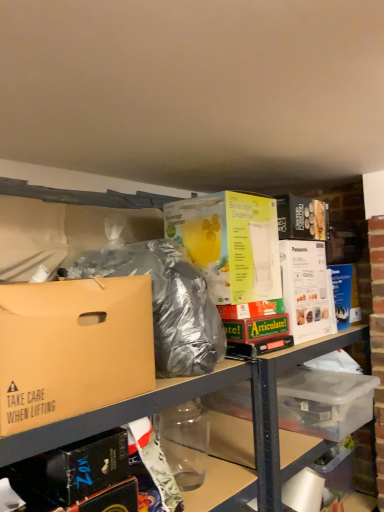
Question: From the image's perspective, is clear plastic bottle at lower center beneath clear plastic storage box at lower right?

Choices:
 (A) yes
 (B) no

Answer: (B)

Question: Is clear plastic bottle at lower center positioned far away from clear plastic storage box at lower right?

Choices:
 (A) no
 (B) yes

Answer: (A)

Question: From the image's perspective, is clear plastic bottle at lower center on top of clear plastic storage box at lower right?

Choices:
 (A) yes
 (B) no

Answer: (A)

Question: Does clear plastic bottle at lower center have a larger size compared to clear plastic storage box at lower right?

Choices:
 (A) yes
 (B) no

Answer: (B)

Question: Is clear plastic bottle at lower center at the right side of clear plastic storage box at lower right?

Choices:
 (A) yes
 (B) no

Answer: (B)

Question: Would you say clear plastic bottle at lower center is to the left or to the right of shiny metallic bag at center in the picture?

Choices:
 (A) right
 (B) left

Answer: (B)

Question: In terms of size, does clear plastic bottle at lower center appear bigger or smaller than shiny metallic bag at center?

Choices:
 (A) big
 (B) small

Answer: (B)

Question: From the image's perspective, is clear plastic bottle at lower center located above or below shiny metallic bag at center?

Choices:
 (A) below
 (B) above

Answer: (A)

Question: Is clear plastic bottle at lower center wider or thinner than shiny metallic bag at center?

Choices:
 (A) wide
 (B) thin

Answer: (A)

Question: Is yellow cardboard beverage dispenser at center, the 1th box when ordered from back to front, spatially inside shiny metallic bag at center, or outside of it?

Choices:
 (A) inside
 (B) outside

Answer: (B)

Question: Considering the positions of yellow cardboard beverage dispenser at center, the 2th box positioned from the left, and shiny metallic bag at center in the image, is yellow cardboard beverage dispenser at center, the 2th box positioned from the left, wider or thinner than shiny metallic bag at center?

Choices:
 (A) thin
 (B) wide

Answer: (B)

Question: Looking at the image, does yellow cardboard beverage dispenser at center, which is the first box from right to left, seem bigger or smaller compared to shiny metallic bag at center?

Choices:
 (A) big
 (B) small

Answer: (A)

Question: From a real-world perspective, is yellow cardboard beverage dispenser at center, the 2th box positioned from the left, positioned above or below shiny metallic bag at center?

Choices:
 (A) below
 (B) above

Answer: (B)

Question: From the image's perspective, is yellow cardboard beverage dispenser at center, the 1th box when ordered from back to front, located above or below clear plastic storage box at lower right?

Choices:
 (A) above
 (B) below

Answer: (A)

Question: In terms of height, does yellow cardboard beverage dispenser at center, the 2th box from the front, look taller or shorter compared to clear plastic storage box at lower right?

Choices:
 (A) tall
 (B) short

Answer: (A)